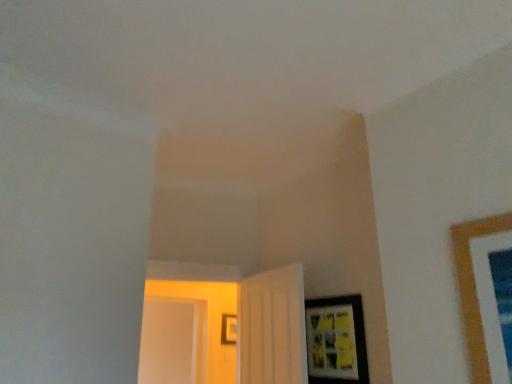
Question: From a real-world perspective, is matte black picture frame at center, acting as the second picture frame starting from the right, above or below white glossy door at center, acting as the 1th door starting from the left?

Choices:
 (A) below
 (B) above

Answer: (B)

Question: Looking at their shapes, would you say matte black picture frame at center, which is the second picture frame from front to back, is wider or thinner than white glossy door at center, which ranks as the 2th door in right-to-left order?

Choices:
 (A) thin
 (B) wide

Answer: (A)

Question: Which object is the farthest from the matte black picture frame at center, acting as the second picture frame starting from the right?

Choices:
 (A) matte black picture frame at lower right, the 2th picture frame viewed from the left
 (B) white glossy door at center, acting as the 1th door starting from the left
 (C) white matte door at center, the second door in the left-to-right sequence
 (D) transparent glass door at left

Answer: (A)

Question: Estimate the real-world distances between objects in this image. Which object is closer to the matte black picture frame at center, which ranks as the first picture frame in back-to-front order?

Choices:
 (A) white matte door at center, the second door in the left-to-right sequence
 (B) white glossy door at center, acting as the 1th door starting from the left
 (C) transparent glass door at left
 (D) matte black picture frame at lower right, the second picture frame positioned from the back

Answer: (B)